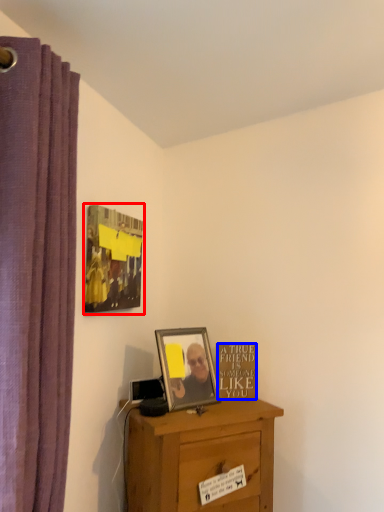
Question: Among these objects, which one is farthest to the camera, picture frame (highlighted by a red box) or writing (highlighted by a blue box)?

Choices:
 (A) picture frame
 (B) writing

Answer: (B)